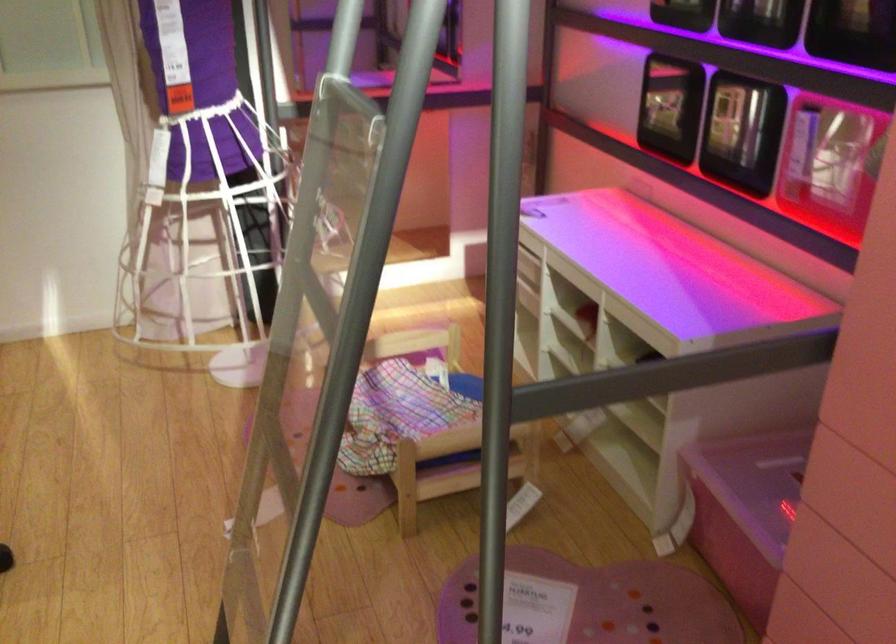
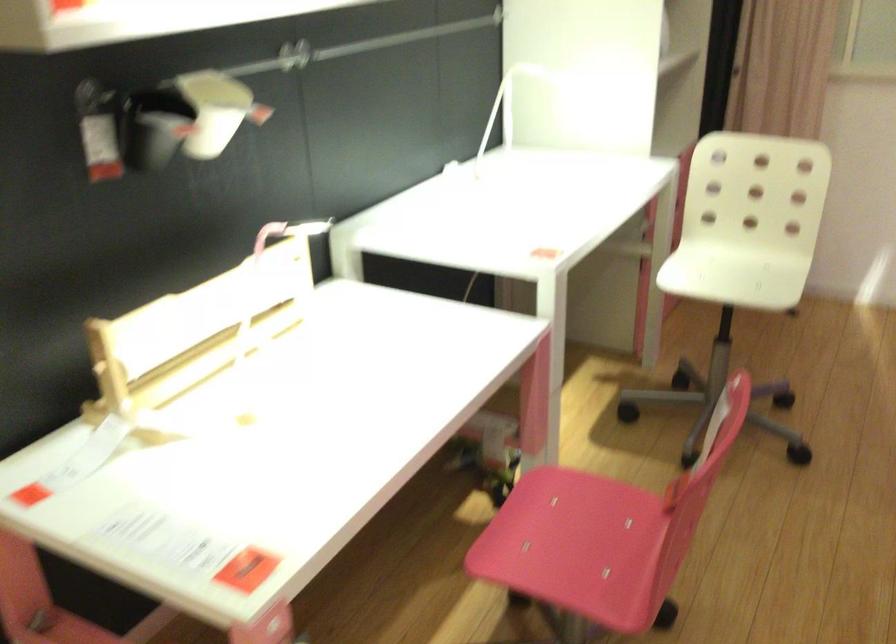
Question: Based on the continuous images, in which direction is the camera rotating? Reply with the corresponding letter.

Choices:
 (A) Left
 (B) Right
 (C) Up
 (D) Down

Answer: (A)